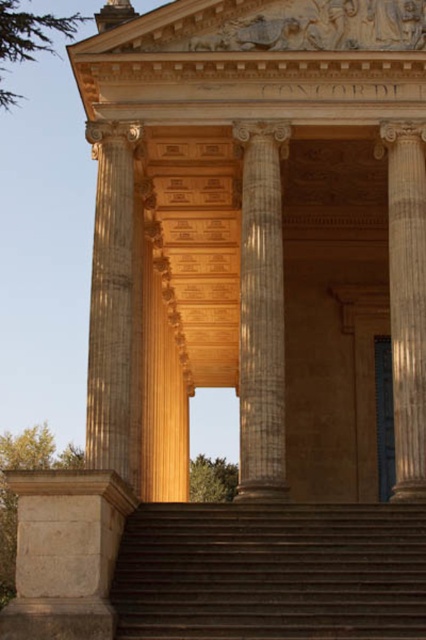
Can you confirm if white marble column at center is thinner than smooth stone column at right?

Indeed, white marble column at center has a lesser width compared to smooth stone column at right.

This screenshot has height=640, width=426. What do you see at coordinates (261, 314) in the screenshot? I see `white marble column at center` at bounding box center [261, 314].

Which is behind, point (268, 353) or point (420, 372)?

The point (268, 353) is behind.

You are a GUI agent. You are given a task and a screenshot of the screen. Output one action in this format:
    pyautogui.click(x=<x>, y=<y>)
    Task: Click on the white marble column at center
    This screenshot has width=426, height=640.
    Given the screenshot: What is the action you would take?
    pyautogui.click(x=261, y=314)

Is brown stone stairs at center below white marble column at center?

Correct, brown stone stairs at center is located below white marble column at center.

Is the position of brown stone stairs at center less distant than that of white marble column at center?

Yes, it is in front of white marble column at center.

Find the location of a particular element. The image size is (426, 640). brown stone stairs at center is located at coordinates (270, 572).

Measure the distance between point (336,593) and camera.

Point (336,593) is 43.82 meters away from camera.

Is brown stone stairs at center closer to camera compared to smooth beige column at center?

That is True.

Between point (308, 602) and point (88, 465), which one is positioned behind?

Point (88, 465)

The width and height of the screenshot is (426, 640). What are the coordinates of `brown stone stairs at center` in the screenshot? It's located at (270, 572).